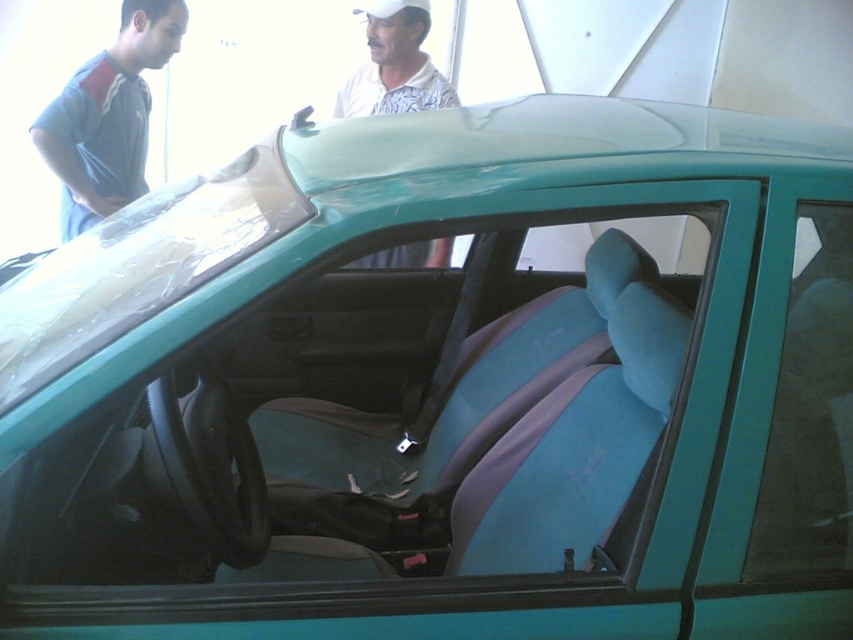
Between gray fabric shirt at upper left and white printed shirt at upper center, which one has less height?

Standing shorter between the two is white printed shirt at upper center.

Is point (77, 200) positioned before point (352, 92)?

Yes, point (77, 200) is in front of point (352, 92).

Locate an element on the screen. The width and height of the screenshot is (853, 640). gray fabric shirt at upper left is located at coordinates (107, 116).